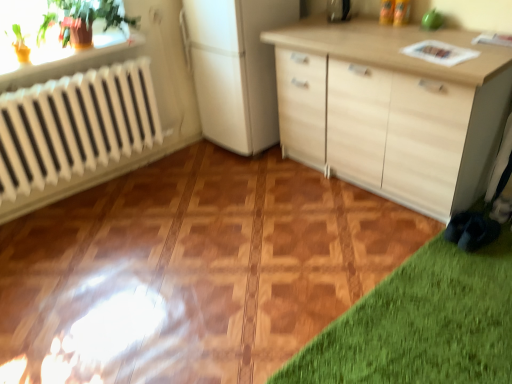
Locate an element on the screen. The width and height of the screenshot is (512, 384). metallic silver toaster at upper center is located at coordinates (338, 10).

The width and height of the screenshot is (512, 384). What do you see at coordinates (338, 10) in the screenshot?
I see `metallic silver toaster at upper center` at bounding box center [338, 10].

What do you see at coordinates (84, 20) in the screenshot? Image resolution: width=512 pixels, height=384 pixels. I see `green glossy plant at upper left` at bounding box center [84, 20].

Where is `green glossy plant at upper left`? green glossy plant at upper left is located at coordinates (84, 20).

Locate an element on the screen. The image size is (512, 384). metallic silver toaster at upper center is located at coordinates click(338, 10).

Considering the positions of objects metallic silver toaster at upper center and green glossy plant at upper left in the image provided, who is more to the right, metallic silver toaster at upper center or green glossy plant at upper left?

metallic silver toaster at upper center is more to the right.

Between metallic silver toaster at upper center and green glossy plant at upper left, which one is positioned behind?

metallic silver toaster at upper center.

Which is behind, point (339, 14) or point (72, 21)?

The point (339, 14) is farther.

From the image's perspective, which one is positioned lower, metallic silver toaster at upper center or green glossy plant at upper left?

green glossy plant at upper left appears lower in the image.

From a real-world perspective, is metallic silver toaster at upper center positioned over green glossy plant at upper left based on gravity?

No, from a real-world perspective, metallic silver toaster at upper center is not over green glossy plant at upper left

Between metallic silver toaster at upper center and green glossy plant at upper left, which one has larger width?

With larger width is green glossy plant at upper left.

Who is taller, metallic silver toaster at upper center or green glossy plant at upper left?

green glossy plant at upper left is taller.

Between metallic silver toaster at upper center and green glossy plant at upper left, which one has larger size?

green glossy plant at upper left.

In the scene shown: Is metallic silver toaster at upper center completely or partially outside of green glossy plant at upper left?

Indeed, metallic silver toaster at upper center is completely outside green glossy plant at upper left.

Is there a large distance between metallic silver toaster at upper center and green glossy plant at upper left?

That's right, there is a large distance between metallic silver toaster at upper center and green glossy plant at upper left.

Is metallic silver toaster at upper center oriented towards green glossy plant at upper left?

No, metallic silver toaster at upper center does not turn towards green glossy plant at upper left.

Identify the location of appliance on the right of the green glossy plant at upper left. (338, 10).

Is green glossy plant at upper left at the left side of metallic silver toaster at upper center?

Yes.

Considering the positions of objects green glossy plant at upper left and metallic silver toaster at upper center in the image provided, who is behind, green glossy plant at upper left or metallic silver toaster at upper center?

Positioned behind is metallic silver toaster at upper center.

Is point (77, 32) in front of point (330, 17)?

Yes, point (77, 32) is closer to viewer.

From the image's perspective, which is below, green glossy plant at upper left or metallic silver toaster at upper center?

From the image's view, green glossy plant at upper left is below.

From a real-world perspective, is green glossy plant at upper left positioned over metallic silver toaster at upper center based on gravity?

Yes, from a real-world perspective, green glossy plant at upper left is on top of metallic silver toaster at upper center.

Based on the photo, which object is wider, green glossy plant at upper left or metallic silver toaster at upper center?

green glossy plant at upper left.

Does green glossy plant at upper left have a greater height compared to metallic silver toaster at upper center?

Yes, green glossy plant at upper left is taller than metallic silver toaster at upper center.

Can you confirm if green glossy plant at upper left is smaller than metallic silver toaster at upper center?

Incorrect, green glossy plant at upper left is not smaller in size than metallic silver toaster at upper center.

Would you say metallic silver toaster at upper center is part of green glossy plant at upper left's contents?

That's incorrect, metallic silver toaster at upper center is not inside green glossy plant at upper left.

Is green glossy plant at upper left touching metallic silver toaster at upper center?

No, green glossy plant at upper left is not touching metallic silver toaster at upper center.

Is metallic silver toaster at upper center at the back of green glossy plant at upper left?

That's not correct — green glossy plant at upper left is not looking away from metallic silver toaster at upper center.

Where is `plant located below the metallic silver toaster at upper center (from the image's perspective)`? plant located below the metallic silver toaster at upper center (from the image's perspective) is located at coordinates (84, 20).

The height and width of the screenshot is (384, 512). Find the location of `appliance lying above the green glossy plant at upper left (from the image's perspective)`. appliance lying above the green glossy plant at upper left (from the image's perspective) is located at coordinates (338, 10).

This screenshot has height=384, width=512. I want to click on appliance below the green glossy plant at upper left (from a real-world perspective), so click(338, 10).